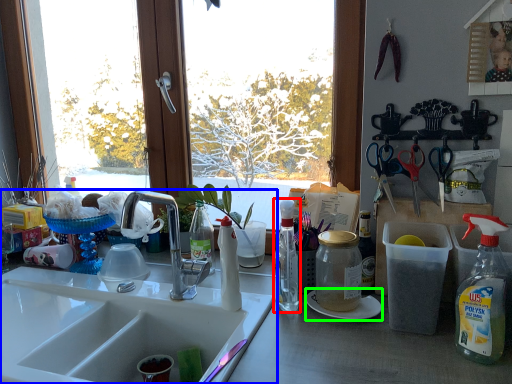
Question: Which is nearer to the bottle (highlighted by a red box)? sink (highlighted by a blue box) or paper plate (highlighted by a green box).

Choices:
 (A) sink
 (B) paper plate

Answer: (B)